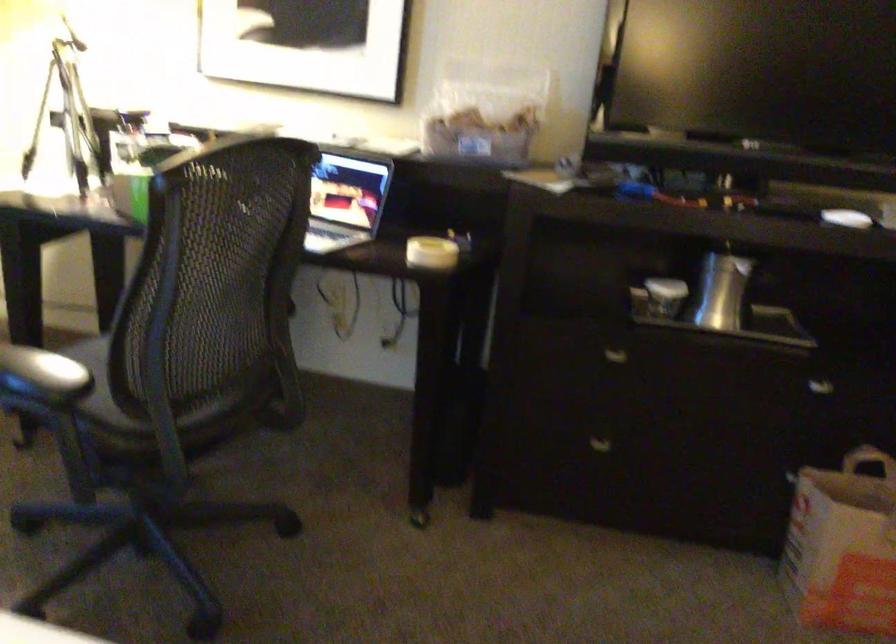
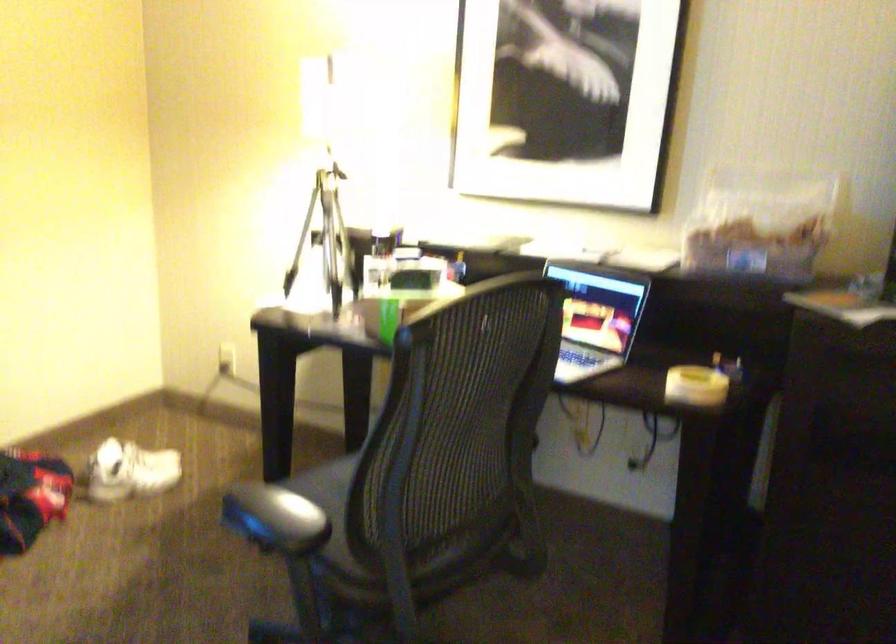
Question: The images are taken continuously from a first-person perspective. In which direction are you moving?

Choices:
 (A) Left
 (B) Right
 (C) Forward
 (D) Backward

Answer: (C)